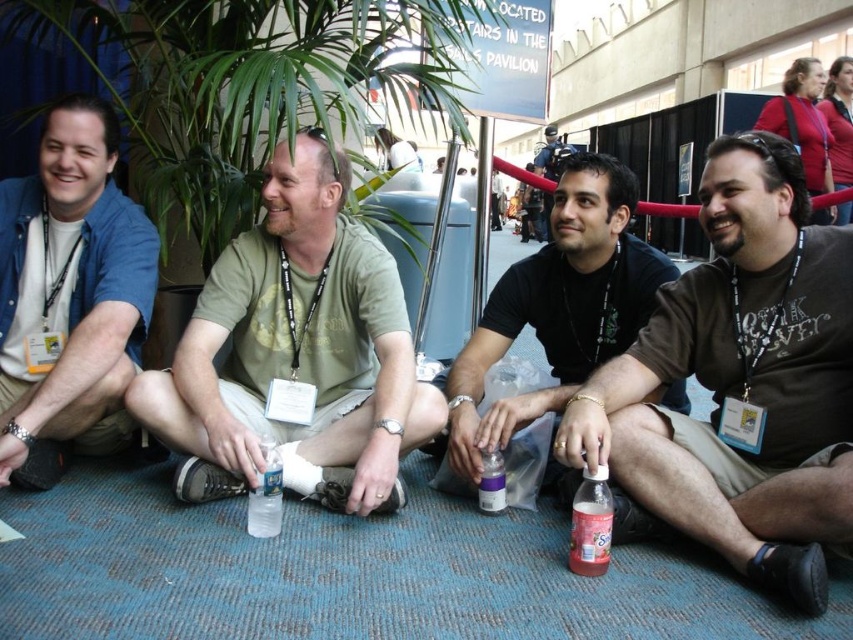
You are standing in the convention hall and see a point marked at coordinates (741, 381). Which object is this point located on?

The point at coordinates (741, 381) is located on the brown cotton shirt at lower right.

Where is the brown cotton shirt at lower right located in the image?

The brown cotton shirt at lower right is located at point [741,381] in the image.

Consider the image. You are organizing a picnic and need to choose between the pink plastic bottle at lower right and the clear plastic bottle at center. Which bottle is taller?

The pink plastic bottle at lower right is taller than the clear plastic bottle at center.